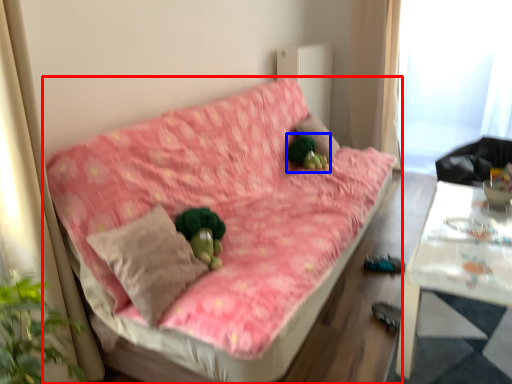
Question: Which object is closer to the camera taking this photo, studio couch (highlighted by a red box) or toy (highlighted by a blue box)?

Choices:
 (A) studio couch
 (B) toy

Answer: (A)